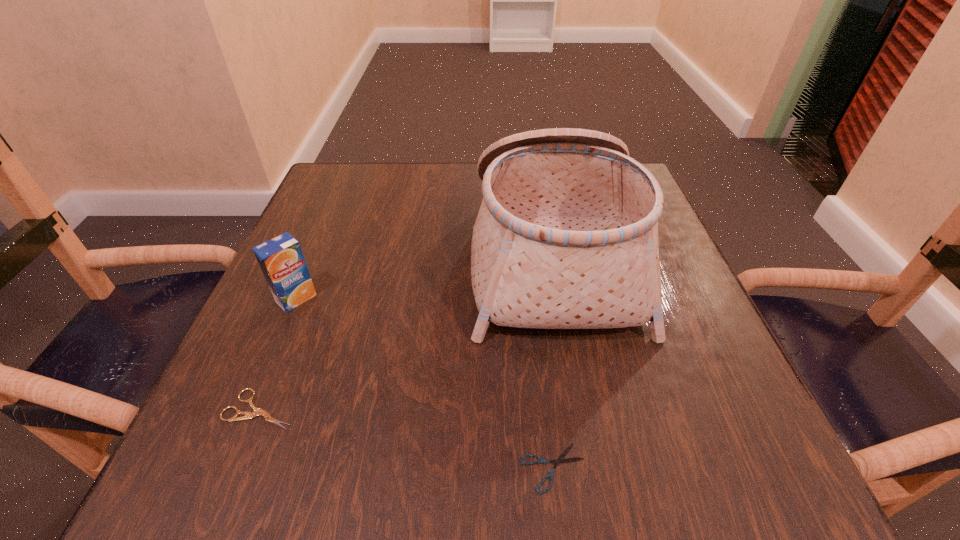
Locate an element on the screen. This screenshot has width=960, height=540. the tallest object is located at coordinates (566, 237).

This screenshot has height=540, width=960. Identify the location of orange_juice. (281, 260).

Find the location of a particular element. Image resolution: width=960 pixels, height=540 pixels. the left shears is located at coordinates (257, 411).

Locate an element on the screen. This screenshot has height=540, width=960. the second shortest object is located at coordinates (257, 411).

Where is `the shorter shears`? the shorter shears is located at coordinates (541, 460).

You are a GUI agent. You are given a task and a screenshot of the screen. Output one action in this format:
    pyautogui.click(x=<x>, y=<y>)
    Task: Click on the nearest object
    
    Given the screenshot: What is the action you would take?
    pyautogui.click(x=541, y=460)

The height and width of the screenshot is (540, 960). In order to click on vacant area located 0.180m with the lid open on the tallest object in this screenshot , I will do `click(381, 257)`.

This screenshot has width=960, height=540. Find the location of `free region located with the lid open on the tallest object`. free region located with the lid open on the tallest object is located at coordinates (346, 257).

Where is `vacant space situated with the lid open on the tallest object`? This screenshot has width=960, height=540. vacant space situated with the lid open on the tallest object is located at coordinates (401, 257).

Where is `vacant space located 0.200m on the front of the second tallest object`? This screenshot has width=960, height=540. vacant space located 0.200m on the front of the second tallest object is located at coordinates (246, 418).